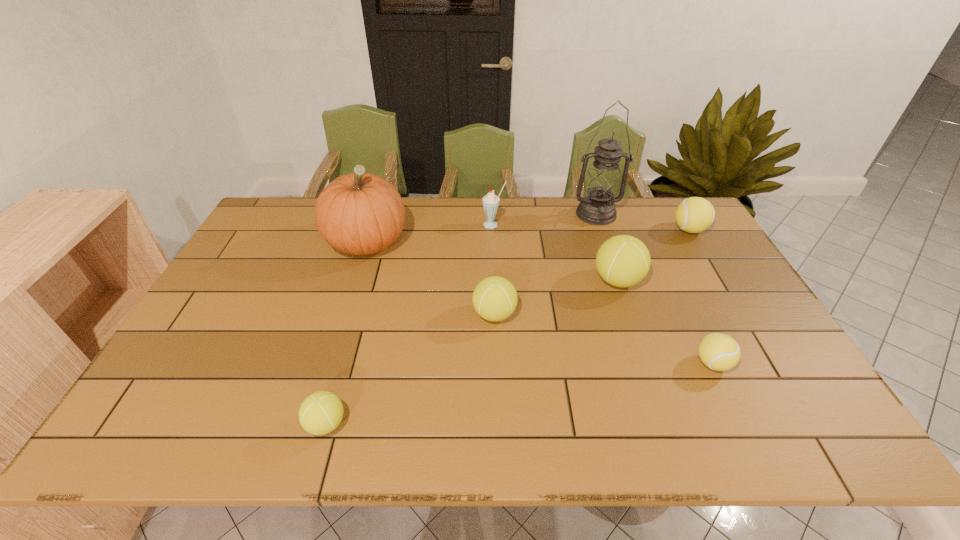
Identify the location of oil lamp. (602, 182).

I want to click on gray oil lamp, so click(x=602, y=182).

Locate an element on the screen. Image resolution: width=960 pixels, height=540 pixels. orange pumpkin is located at coordinates (360, 213).

Locate an element on the screen. the second tallest object is located at coordinates (360, 213).

This screenshot has width=960, height=540. What are the coordinates of `milkshake` in the screenshot? It's located at (490, 201).

Locate an element on the screen. the third tennis ball from right to left is located at coordinates (622, 261).

The height and width of the screenshot is (540, 960). I want to click on the tallest tennis ball, so click(622, 261).

Locate an element on the screen. The height and width of the screenshot is (540, 960). the rightmost tennis ball is located at coordinates click(x=695, y=214).

Identify the location of the farther yellow tennis ball. (695, 214).

The width and height of the screenshot is (960, 540). What are the coordinates of `the second green tennis ball from right to left` in the screenshot? It's located at click(494, 298).